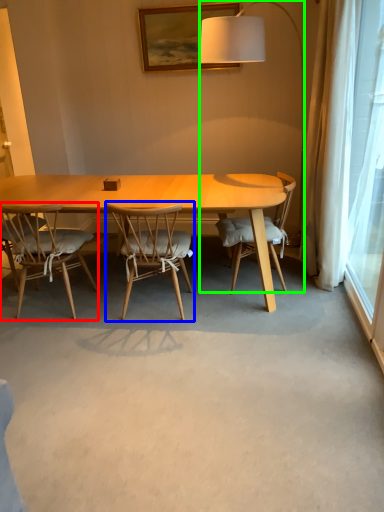
Question: Considering the real-world distances, which object is farthest from chair (highlighted by a red box)? chair (highlighted by a blue box) or lamp (highlighted by a green box)?

Choices:
 (A) chair
 (B) lamp

Answer: (B)